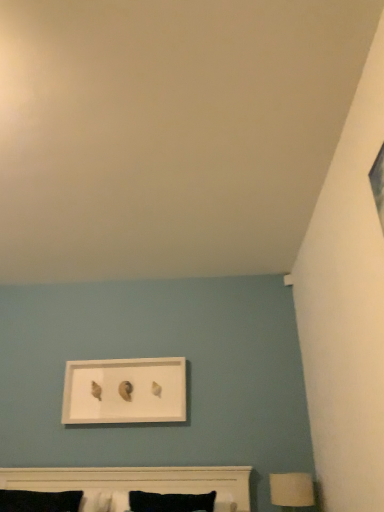
Question: Which is correct: white matte table lamp at lower right is inside white matte bed at lower center, or outside of it?

Choices:
 (A) inside
 (B) outside

Answer: (B)

Question: Would you say white matte table lamp at lower right is to the left or to the right of white matte bed at lower center in the picture?

Choices:
 (A) right
 (B) left

Answer: (A)

Question: Based on their relative distances, which object is farther from the white matte table lamp at lower right?

Choices:
 (A) white matte picture frame at upper center
 (B) white matte bed at lower center

Answer: (A)

Question: Based on their relative distances, which object is farther from the white matte table lamp at lower right?

Choices:
 (A) white matte picture frame at upper center
 (B) white matte bed at lower center

Answer: (A)